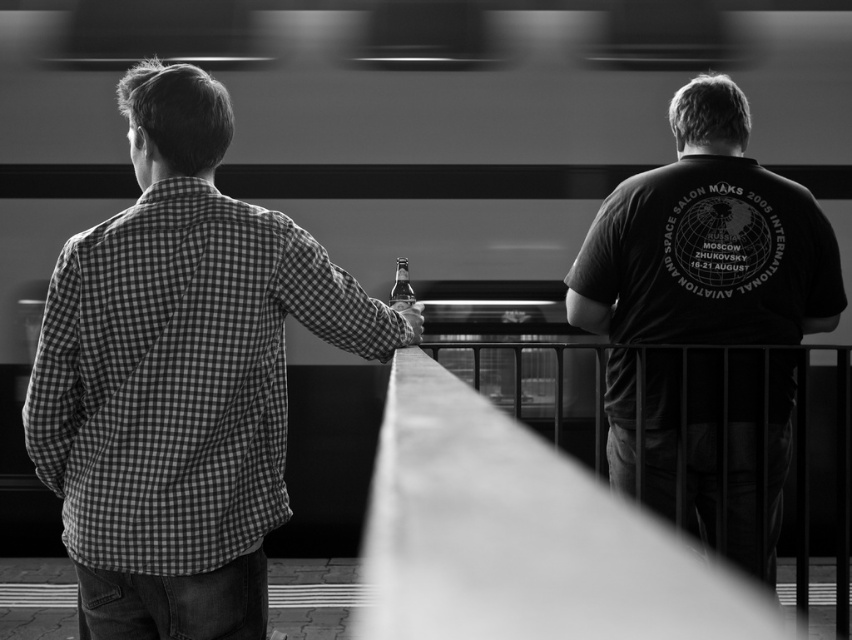
From the picture: Is checkered fabric shirt at left further to the viewer compared to dark gray t-shirt at center?

No, it is in front of dark gray t-shirt at center.

Is checkered fabric shirt at left taller than dark gray t-shirt at center?

Incorrect, checkered fabric shirt at left's height is not larger of dark gray t-shirt at center's.

Where is `checkered fabric shirt at left`? The width and height of the screenshot is (852, 640). checkered fabric shirt at left is located at coordinates (180, 376).

Image resolution: width=852 pixels, height=640 pixels. In order to click on checkered fabric shirt at left in this screenshot , I will do `click(180, 376)`.

Consider the image. Does dark gray t-shirt at center appear over translucent glass bottle at center?

Incorrect, dark gray t-shirt at center is not positioned above translucent glass bottle at center.

Which is behind, point (781, 275) or point (412, 298)?

The point (412, 298) is more distant.

Where is `dark gray t-shirt at center`? Image resolution: width=852 pixels, height=640 pixels. dark gray t-shirt at center is located at coordinates click(707, 243).

Does point (150, 124) come farther from viewer compared to point (393, 301)?

No, (150, 124) is in front of (393, 301).

Between checkered fabric shirt at left and translucent glass bottle at center, which one appears on the right side from the viewer's perspective?

translucent glass bottle at center is more to the right.

Measure the distance between checkered fabric shirt at left and camera.

checkered fabric shirt at left is 8.83 feet away from camera.

Find the location of a particular element. The height and width of the screenshot is (640, 852). checkered fabric shirt at left is located at coordinates (180, 376).